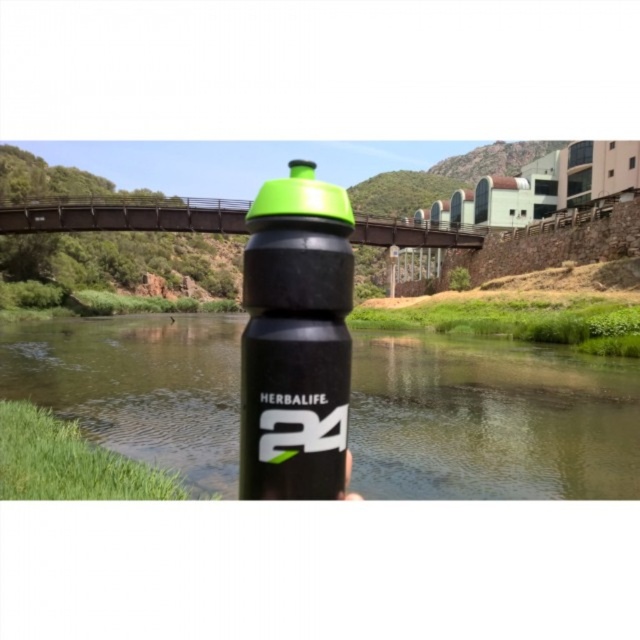
From the picture: You are a photographer trying to capture the entire scene of the green matte water at center and the matte black bottle at center in one shot. Given their sizes, which object will occupy more of the frame?

The green matte water at center is larger in size than the matte black bottle at center, so it will occupy more of the frame.

You are taking a photo of the black water bottle with the green cap. There are two points marked on the bottle, one at coordinates point (40, 387) and another at point (284, 212). Which point is closer to the camera lens?

Point (40, 387) is further to the camera than point (284, 212), so the point closer to the camera lens is point (284, 212).